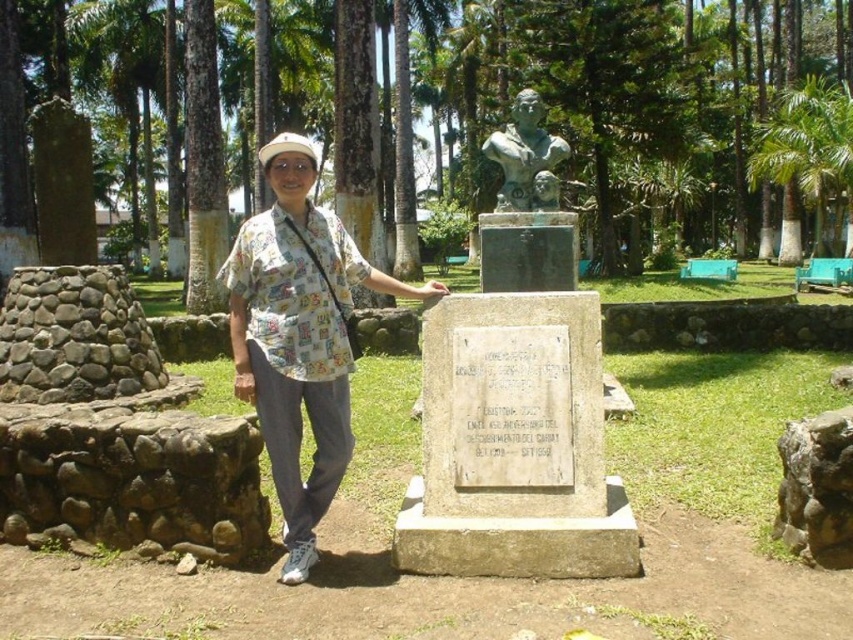
Can you confirm if green leafy palm tree at upper left is shorter than bronze bust at center?

No, green leafy palm tree at upper left is not shorter than bronze bust at center.

Is green leafy palm tree at upper left above bronze bust at center?

Correct, green leafy palm tree at upper left is located above bronze bust at center.

Is point (170, 173) positioned in front of point (537, 172)?

No, (170, 173) is behind (537, 172).

Identify the location of green leafy palm tree at upper left. (135, 92).

Looking at this image, does printed cotton shirt at center appear under green leafy palm tree at upper left?

Yes, printed cotton shirt at center is below green leafy palm tree at upper left.

The width and height of the screenshot is (853, 640). Describe the element at coordinates (299, 337) in the screenshot. I see `printed cotton shirt at center` at that location.

Image resolution: width=853 pixels, height=640 pixels. I want to click on printed cotton shirt at center, so click(x=299, y=337).

Based on the photo, is green leafy palm tree at upper left closer to camera compared to green leafy palm tree at upper right?

That is False.

Is green leafy palm tree at upper left thinner than green leafy palm tree at upper right?

Correct, green leafy palm tree at upper left's width is less than green leafy palm tree at upper right's.

Between point (154, 86) and point (840, 124), which one is positioned behind?

The point (154, 86) is more distant.

I want to click on green leafy palm tree at upper left, so click(135, 92).